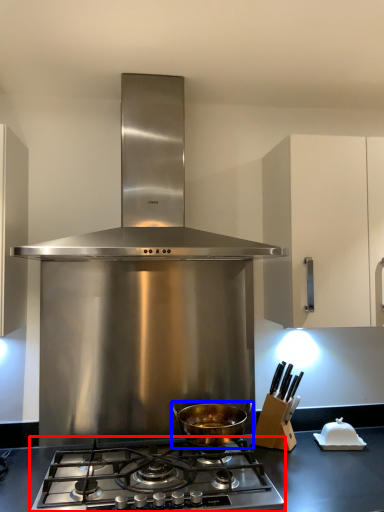
Question: Which point is closer to the camera, gas stove (highlighted by a red box) or kitchen appliance (highlighted by a blue box)?

Choices:
 (A) gas stove
 (B) kitchen appliance

Answer: (A)